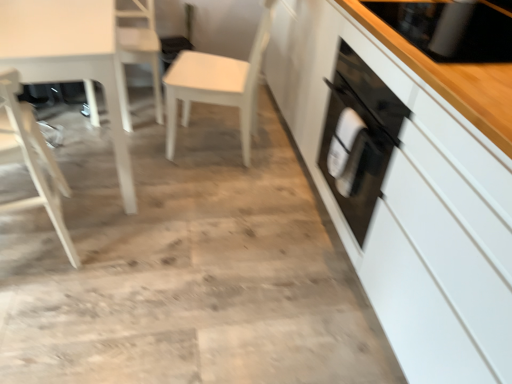
The width and height of the screenshot is (512, 384). Find the location of `vacant region below white wood chair at left, which appears as the third chair when viewed from the right (from a real-world perspective)`. vacant region below white wood chair at left, which appears as the third chair when viewed from the right (from a real-world perspective) is located at coordinates (35, 244).